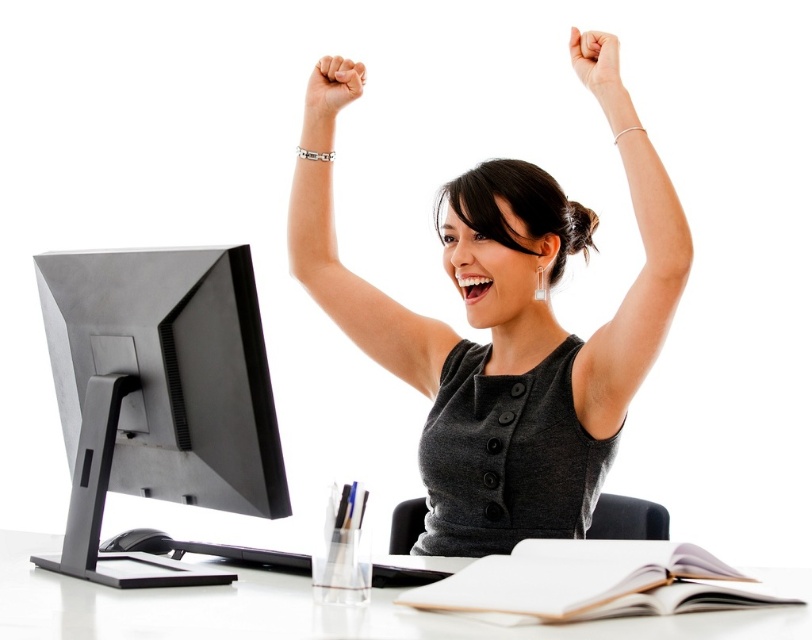
Question: Considering the relative positions of gray matte dress at center and white matte hand at upper center in the image provided, where is gray matte dress at center located with respect to white matte hand at upper center?

Choices:
 (A) above
 (B) below

Answer: (B)

Question: Which point is farther to the camera?

Choices:
 (A) (525, 208)
 (B) (330, 58)
 (C) (772, 580)

Answer: (B)

Question: Is silver metallic bracelet at upper center further to the viewer compared to matte silver bracelet at upper center?

Choices:
 (A) no
 (B) yes

Answer: (B)

Question: Which object is farther from the camera taking this photo?

Choices:
 (A) black matte computer monitor at left
 (B) gray matte dress at center
 (C) satin silver arm at upper center

Answer: (B)

Question: Does satin silver arm at upper center have a lesser width compared to white matte hand at upper center?

Choices:
 (A) yes
 (B) no

Answer: (B)

Question: Which object appears farthest from the camera in this image?

Choices:
 (A) silver metallic bracelet at upper center
 (B) white matte hand at upper center

Answer: (A)